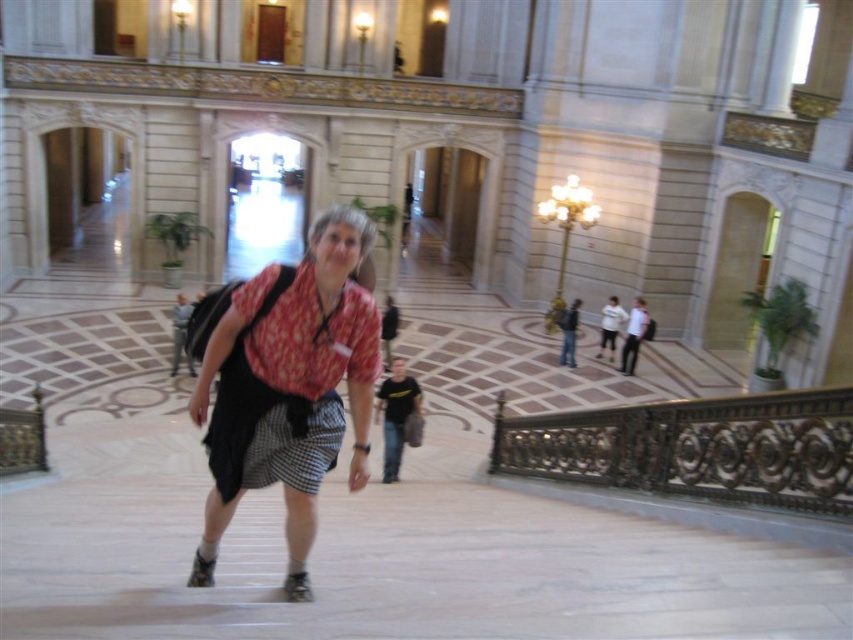
Question: Can you confirm if matte pink blouse at center is positioned above gold ornate railing at lower right?

Choices:
 (A) yes
 (B) no

Answer: (A)

Question: Among these points, which one is farthest from the camera?

Choices:
 (A) (560, 420)
 (B) (289, 547)

Answer: (A)

Question: Does matte pink blouse at center come in front of gold ornate railing at lower right?

Choices:
 (A) yes
 (B) no

Answer: (A)

Question: Which object is farther from the camera taking this photo?

Choices:
 (A) matte pink blouse at center
 (B) gold ornate railing at lower right

Answer: (B)

Question: Which point is farther from the camera taking this photo?

Choices:
 (A) (337, 298)
 (B) (810, 420)

Answer: (B)

Question: In this image, where is matte pink blouse at center located relative to gold ornate railing at lower right?

Choices:
 (A) below
 (B) above

Answer: (B)